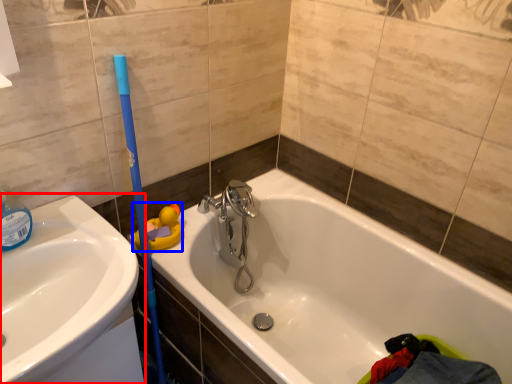
Question: Which object appears farthest to the camera in this image, sink (highlighted by a red box) or toy (highlighted by a blue box)?

Choices:
 (A) sink
 (B) toy

Answer: (B)